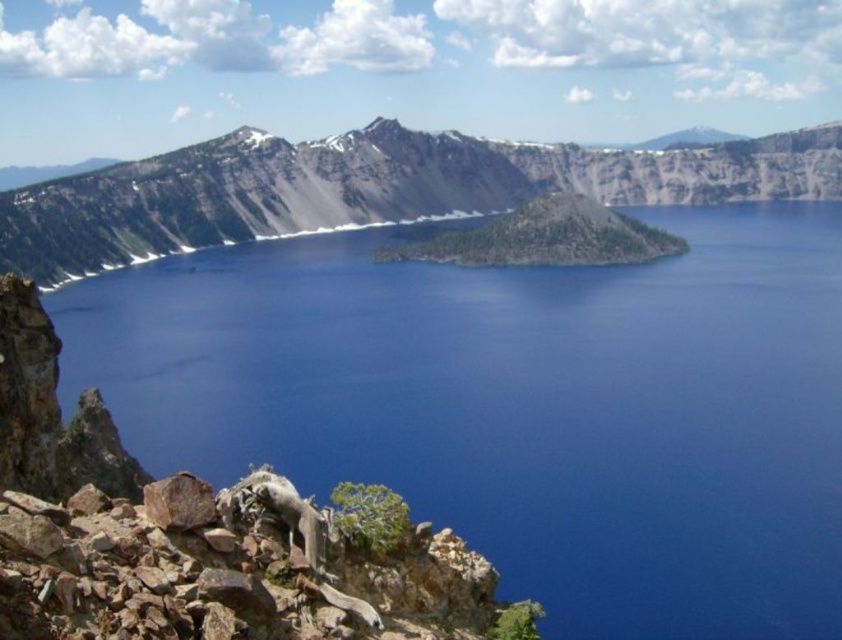
Question: Which point is farther from the camera taking this photo?

Choices:
 (A) (406, 467)
 (B) (313, 525)

Answer: (A)

Question: Based on their relative distances, which object is farther from the rusty rock at lower left?

Choices:
 (A) gray rocky mountain at center
 (B) gray fur goat at lower left
 (C) blue water at center

Answer: (A)

Question: Can you confirm if blue water at center is thinner than gray rocky mountain at center?

Choices:
 (A) yes
 (B) no

Answer: (A)

Question: Which point is closer to the camera?

Choices:
 (A) gray fur goat at lower left
 (B) gray rocky mountain at center
 (C) blue water at center

Answer: (A)

Question: Does rusty rock at lower left have a lesser width compared to gray rocky mountain at center?

Choices:
 (A) no
 (B) yes

Answer: (B)

Question: Is gray rocky mountain at center bigger than gray fur goat at lower left?

Choices:
 (A) no
 (B) yes

Answer: (B)